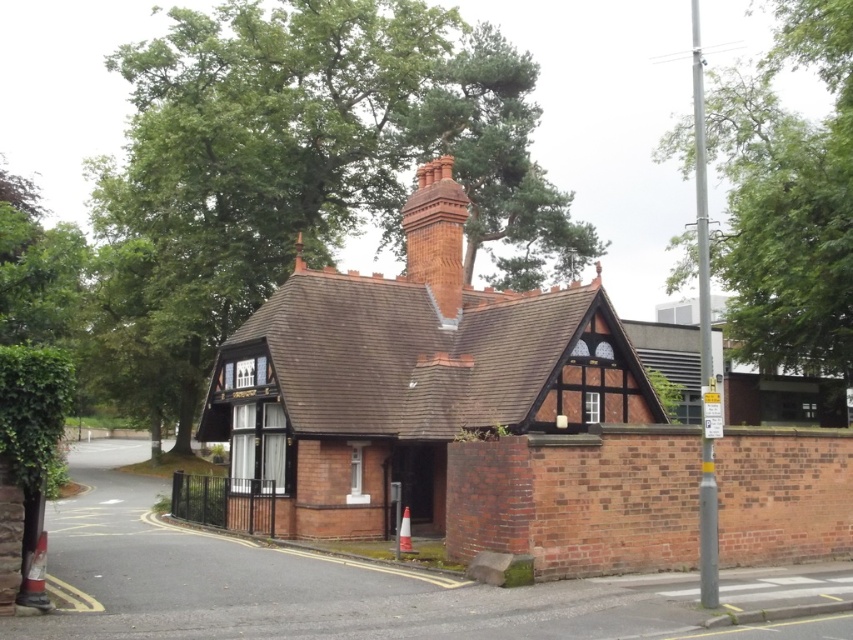
You are standing on the sidewalk in front of the building and notice both the green leafy tree at upper center and the red brick chimney at upper center. Which object appears taller in the image?

The green leafy tree at upper center appears taller than the red brick chimney at upper center in the image.

You are standing on the sidewalk in front of the building and want to take a photo of the green leafy tree at upper center. If your camera can focus on objects up to 50 meters away, will you need to adjust your position to get a clear shot?

The green leafy tree at upper center is 57.41 meters away from the viewer, which is beyond the camera focus range of 50 meters. You need to move closer to the green leafy tree at upper center to ensure it is within the camera focus range.